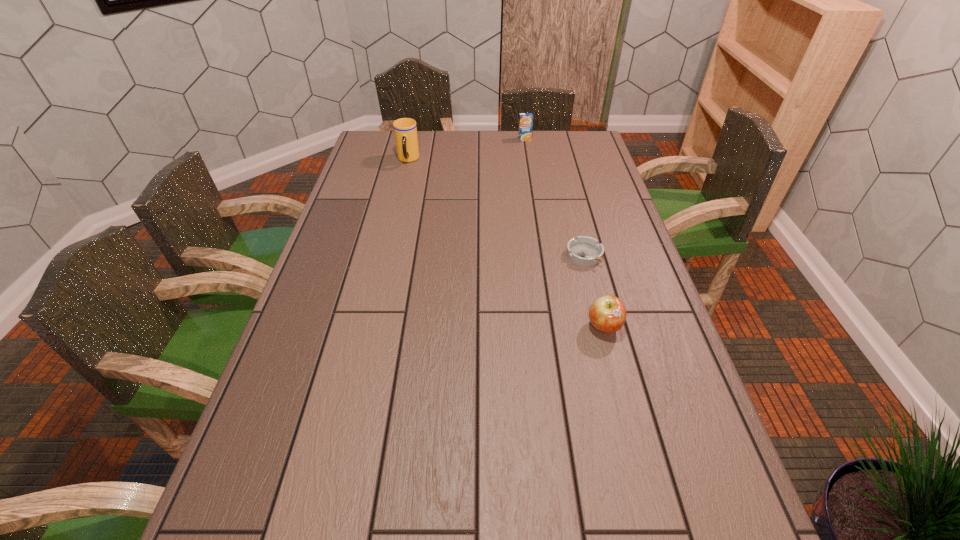
Identify the location of vacant space located 0.180m on the front of the apple. This screenshot has width=960, height=540. (625, 409).

Locate an element on the screen. Image resolution: width=960 pixels, height=540 pixels. free space located 0.310m on the front of the ashtray is located at coordinates (611, 360).

The image size is (960, 540). What are the coordinates of `cup positioned at the far edge` in the screenshot? It's located at (405, 129).

Identify the location of orange_juice that is positioned at the far edge. The height and width of the screenshot is (540, 960). (525, 119).

I want to click on object located in the left edge section of the desktop, so tap(405, 129).

This screenshot has width=960, height=540. Identify the location of apple that is at the right edge. (607, 314).

Identify the location of ashtray positioned at the right edge. (585, 251).

Find the location of a particular element. This screenshot has height=540, width=960. object that is at the far left corner is located at coordinates (405, 129).

Find the location of a particular element. The height and width of the screenshot is (540, 960). free region at the far edge of the desktop is located at coordinates coord(444,159).

In the image, there is a desktop. Where is `vacant space at the left edge`? This screenshot has width=960, height=540. vacant space at the left edge is located at coordinates (248, 508).